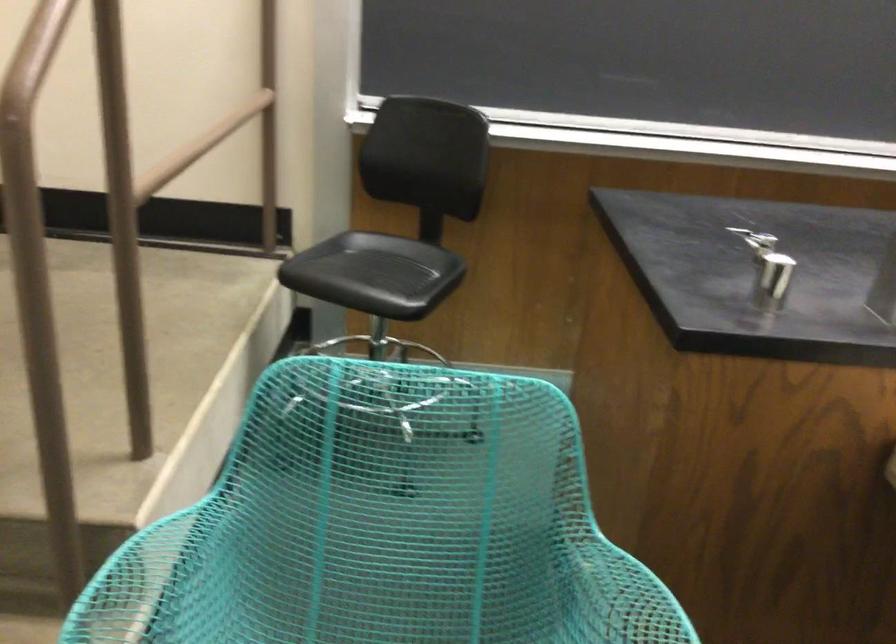
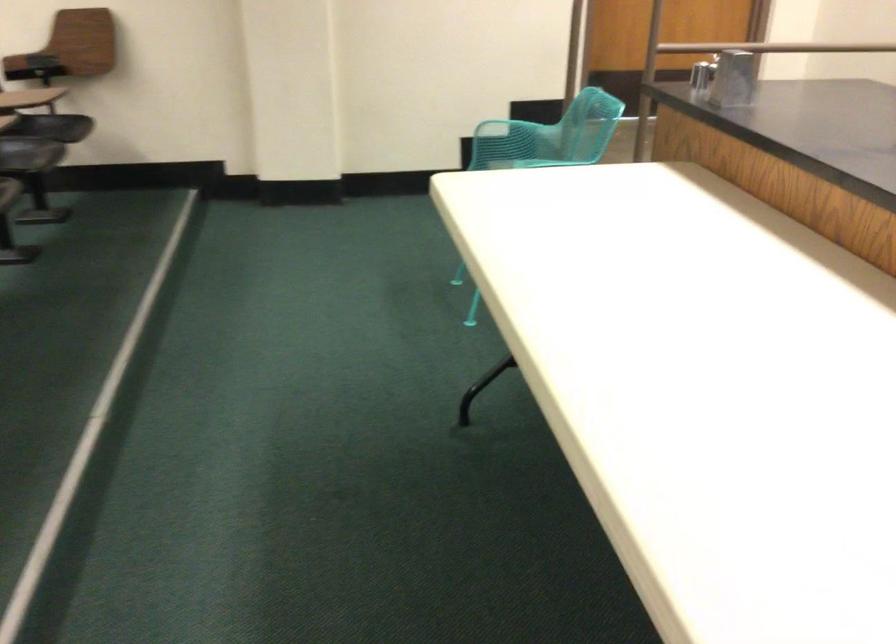
Find the pixel in the second image that matches (764,281) in the first image.

(702, 75)